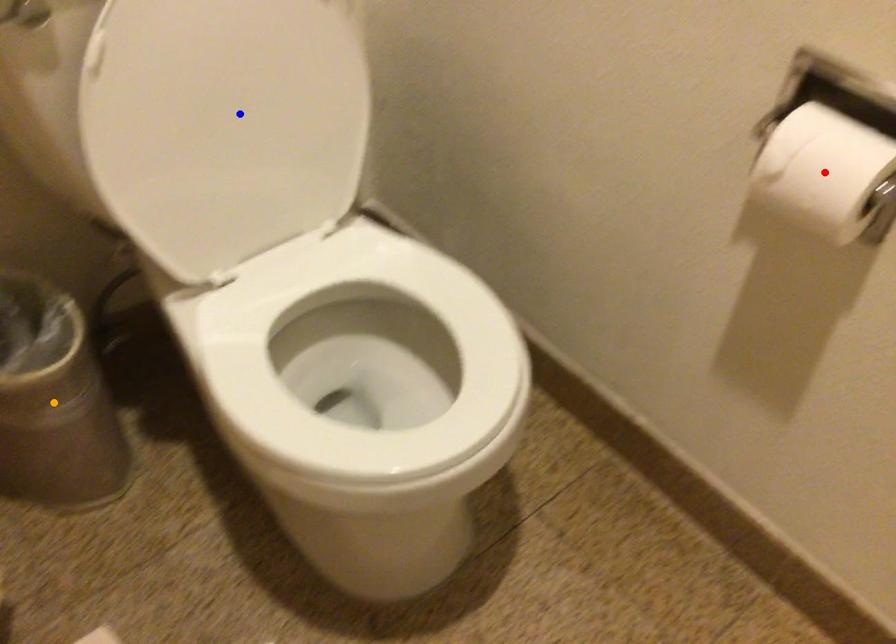
Order these from nearest to farthest:
blue point | red point | orange point

red point → blue point → orange point